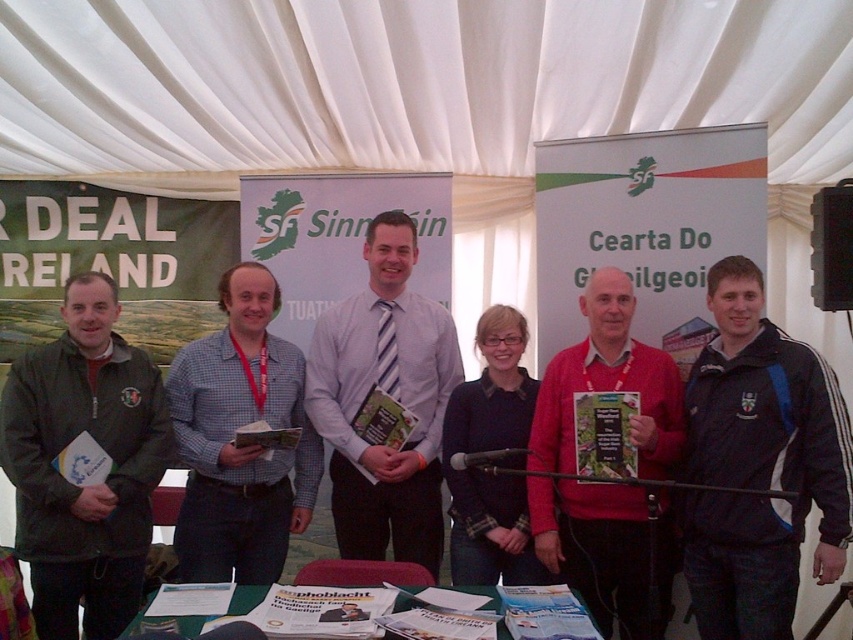
You are standing at the center of the image and want to move towards the two points mentioned. Which point, point (802, 388) or point (62, 428), is closer to you?

Point (802, 388) is closer to the viewer than point (62, 428).

You are organizing a photo shoot and need to arrange the participants in order from left to right based on their clothing. Given the green matte jacket at left and the checkered fabric shirt at center, which clothing item should be placed first from the left side?

The green matte jacket at left should be placed first from the left side because it is positioned on the left side of the checkered fabric shirt at center.